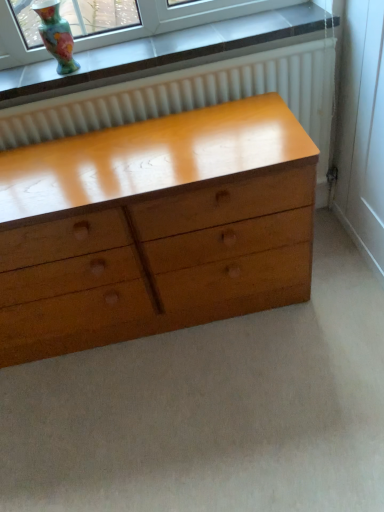
Question: Can you confirm if multicolored glass vase at upper left is taller than glossy wood chest of drawers at center?

Choices:
 (A) no
 (B) yes

Answer: (A)

Question: Considering the relative sizes of multicolored glass vase at upper left and glossy wood chest of drawers at center in the image provided, is multicolored glass vase at upper left shorter than glossy wood chest of drawers at center?

Choices:
 (A) yes
 (B) no

Answer: (A)

Question: Does multicolored glass vase at upper left turn towards glossy wood chest of drawers at center?

Choices:
 (A) no
 (B) yes

Answer: (A)

Question: From a real-world perspective, is multicolored glass vase at upper left on glossy wood chest of drawers at center?

Choices:
 (A) yes
 (B) no

Answer: (A)

Question: Does multicolored glass vase at upper left have a smaller size compared to glossy wood chest of drawers at center?

Choices:
 (A) yes
 (B) no

Answer: (A)

Question: Is multicolored glass vase at upper left not near glossy wood chest of drawers at center?

Choices:
 (A) yes
 (B) no

Answer: (B)

Question: Is glossy wood chest of drawers at center thinner than multicolored glass vase at upper left?

Choices:
 (A) no
 (B) yes

Answer: (A)

Question: From a real-world perspective, is glossy wood chest of drawers at center below multicolored glass vase at upper left?

Choices:
 (A) no
 (B) yes

Answer: (B)

Question: Is there a large distance between glossy wood chest of drawers at center and multicolored glass vase at upper left?

Choices:
 (A) yes
 (B) no

Answer: (B)

Question: Is glossy wood chest of drawers at center oriented away from multicolored glass vase at upper left?

Choices:
 (A) yes
 (B) no

Answer: (B)

Question: Considering the relative sizes of glossy wood chest of drawers at center and multicolored glass vase at upper left in the image provided, is glossy wood chest of drawers at center bigger than multicolored glass vase at upper left?

Choices:
 (A) no
 (B) yes

Answer: (B)

Question: Considering the relative positions of glossy wood chest of drawers at center and multicolored glass vase at upper left in the image provided, is glossy wood chest of drawers at center in front of multicolored glass vase at upper left?

Choices:
 (A) yes
 (B) no

Answer: (A)

Question: Is glossy wood chest of drawers at center taller or shorter than multicolored glass vase at upper left?

Choices:
 (A) short
 (B) tall

Answer: (B)